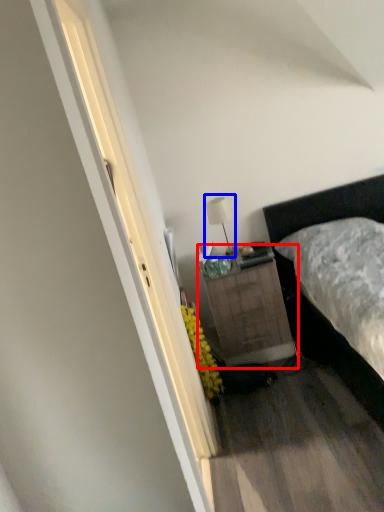
Question: Which of the following is the farthest to the observer, nightstand (highlighted by a red box) or table lamp (highlighted by a blue box)?

Choices:
 (A) nightstand
 (B) table lamp

Answer: (B)